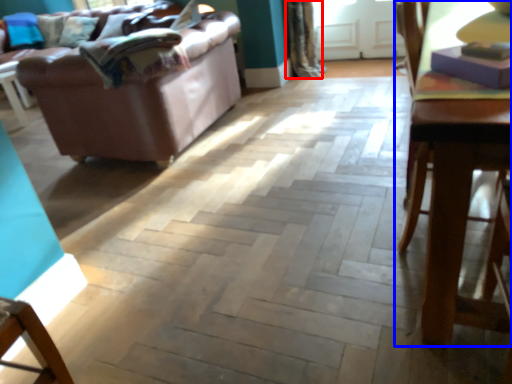
Question: Which object is closer to the camera taking this photo, curtain (highlighted by a red box) or table (highlighted by a blue box)?

Choices:
 (A) curtain
 (B) table

Answer: (B)